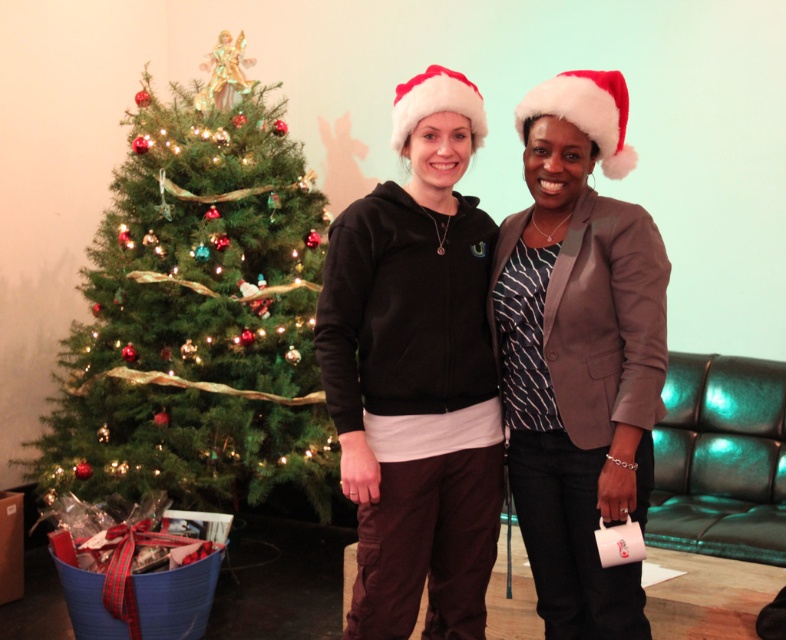
How much distance is there between green textured christmas tree at left and black soft hoodie at center?

A distance of 5.13 feet exists between green textured christmas tree at left and black soft hoodie at center.

Which is more to the left, green textured christmas tree at left or black soft hoodie at center?

Positioned to the left is green textured christmas tree at left.

Where is `green textured christmas tree at left`? This screenshot has height=640, width=786. green textured christmas tree at left is located at coordinates (197, 310).

Is green textured christmas tree at left positioned behind red velvet santa hat at upper center?

Yes, green textured christmas tree at left is further from the viewer.

Can you confirm if green textured christmas tree at left is shorter than red velvet santa hat at upper center?

No.

Locate an element on the screen. green textured christmas tree at left is located at coordinates (197, 310).

Can you confirm if black soft hoodie at center is wider than red velvet santa hat at upper center?

Yes.

Find the location of a particular element. black soft hoodie at center is located at coordinates (579, 353).